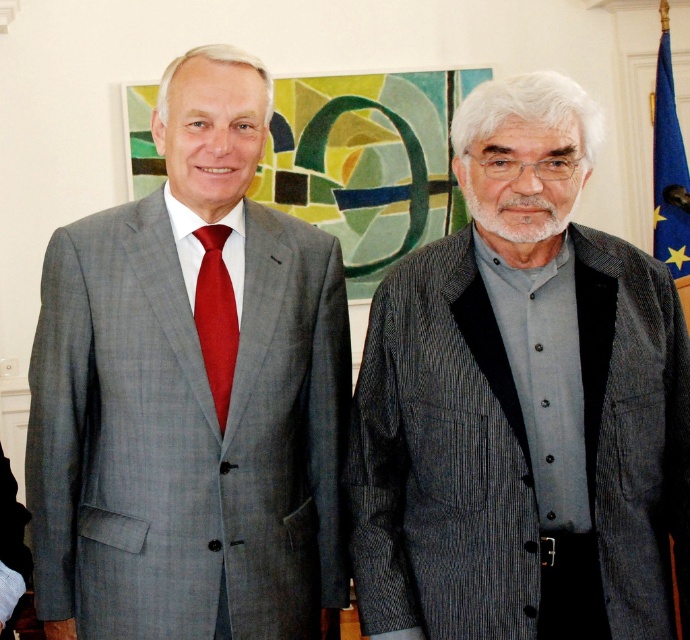
In the scene shown: You are standing in a formal indoor setting where two men are present. You need to determine if you can comfortably step forward to get a closer look at the point marked at coordinates point (164, 100) without encroaching on their personal space. The recommended safe distance for personal space is 4 feet. Can you step forward?

The distance between you and point (164, 100) is 5.95 feet. Since the recommended safe distance is 4 feet, you can step forward to reduce the distance to 4 feet while maintaining personal space.

You are a photographer adjusting the lighting for a portrait. You need to ensure that the matte gray suit at left and the matte red tie at left are evenly lit. Given their distance apart, can you estimate how far apart they are in centimeters?

The matte gray suit at left is 18.37 centimeters from matte red tie at left, so you can adjust the lighting accordingly to ensure both are evenly lit at this distance.